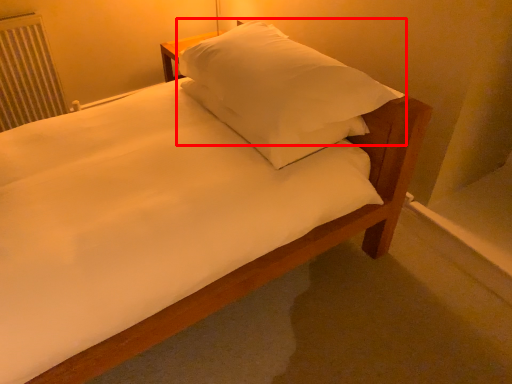
Question: From the image's perspective, what is the correct spatial relationship of pillow (annotated by the red box) in relation to radiator?

Choices:
 (A) above
 (B) below

Answer: (B)